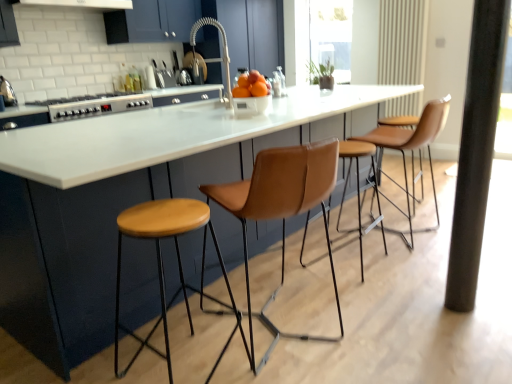
Locate an element on the screen. free location in front of black matte pillar at right is located at coordinates (475, 322).